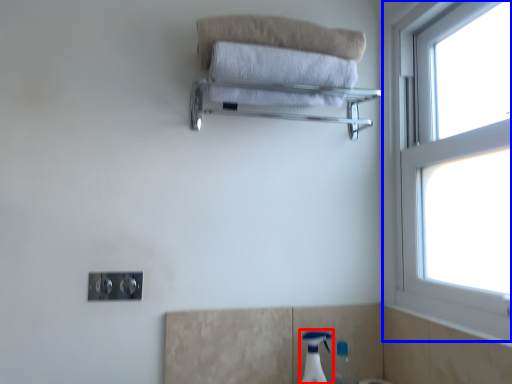
Question: Which point is further to the camera, soap dispenser (highlighted by a red box) or window (highlighted by a blue box)?

Choices:
 (A) soap dispenser
 (B) window

Answer: (A)